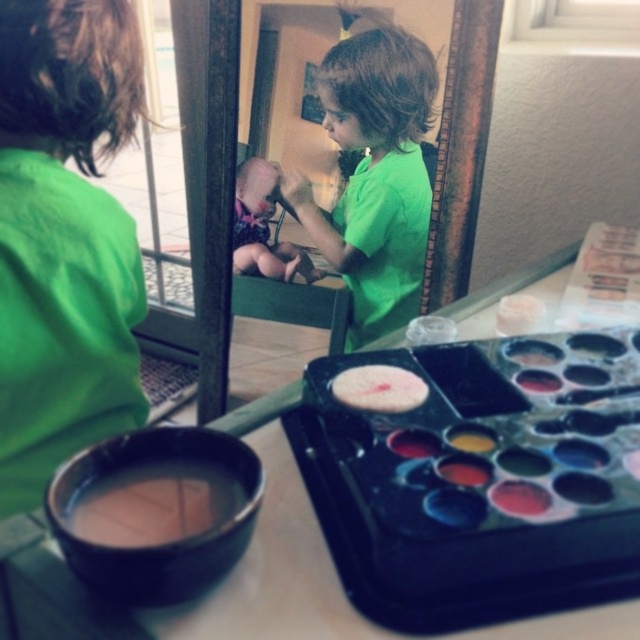
Question: Does shiny plastic paint tray at lower right appear on the left side of green matte shirt at upper left?

Choices:
 (A) no
 (B) yes

Answer: (A)

Question: Considering the real-world distances, which object is farthest from the green matte shirt at upper left?

Choices:
 (A) green matte shirt at center
 (B) brown matte paint at lower left
 (C) shiny plastic paint tray at lower right
 (D) matte pink toy at center

Answer: (D)

Question: Which object appears closest to the camera in this image?

Choices:
 (A) green matte shirt at upper left
 (B) shiny plastic paint tray at lower right
 (C) green matte shirt at center
 (D) matte pink toy at center

Answer: (B)

Question: Among these objects, which one is nearest to the camera?

Choices:
 (A) shiny plastic paint tray at lower right
 (B) matte pink toy at center
 (C) green matte shirt at upper left
 (D) brown matte paint at lower left

Answer: (A)

Question: Is green matte shirt at upper left bigger than green matte shirt at center?

Choices:
 (A) yes
 (B) no

Answer: (B)

Question: Does green matte shirt at center appear on the left side of brown matte paint at lower left?

Choices:
 (A) yes
 (B) no

Answer: (B)